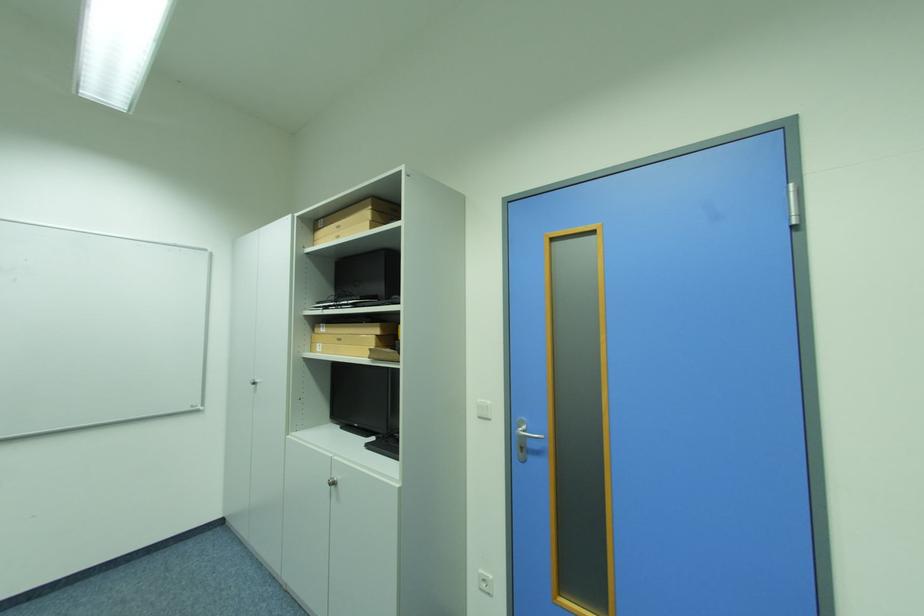
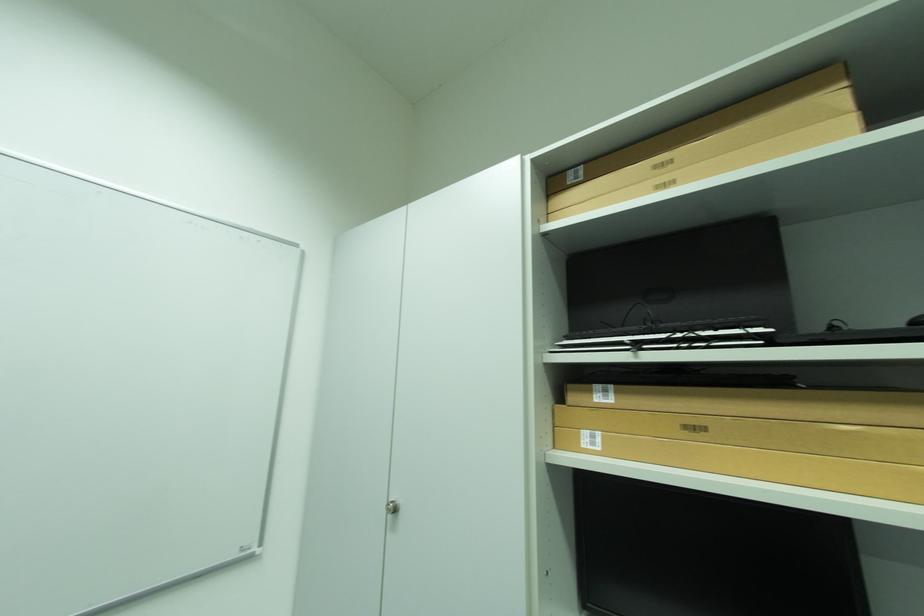
In the second image, find the point that corresponds to [325,345] in the first image.

(593, 434)